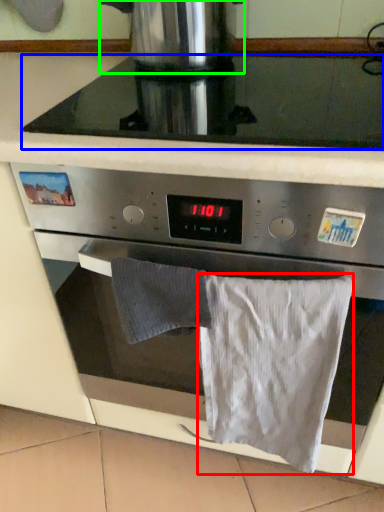
Question: Based on their relative distances, which object is farther from bath towel (highlighted by a red box)? Choose from gas stove (highlighted by a blue box) and kitchen appliance (highlighted by a green box).

Choices:
 (A) gas stove
 (B) kitchen appliance

Answer: (B)